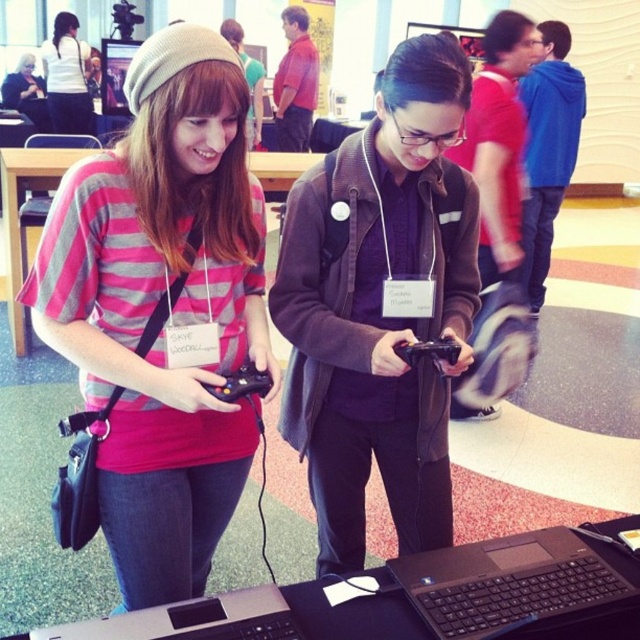
Between matte pink striped shirt at center and matte pink shirt at center, which one has more height?

Standing taller between the two is matte pink shirt at center.

Between matte pink striped shirt at center and matte pink shirt at center, which one appears on the right side from the viewer's perspective?

matte pink striped shirt at center

I want to click on matte pink striped shirt at center, so click(170, 308).

Looking at this image, which is more to the right, dark brown jacket at center or black matte laptop at lower center?

Positioned to the right is black matte laptop at lower center.

Which is in front, point (445, 118) or point (586, 540)?

Point (586, 540) is more forward.

Identify the location of dark brown jacket at center. (380, 307).

Who is shorter, matte pink striped shirt at center or black matte laptop at lower center?

Standing shorter between the two is black matte laptop at lower center.

Does point (237, 406) come closer to viewer compared to point (422, 572)?

No.

Identify the location of matte pink striped shirt at center. (170, 308).